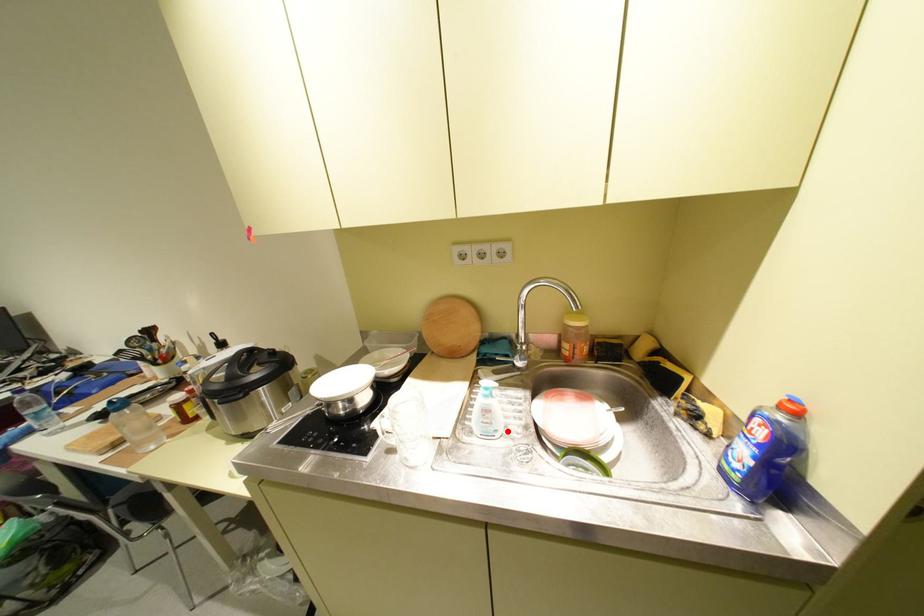
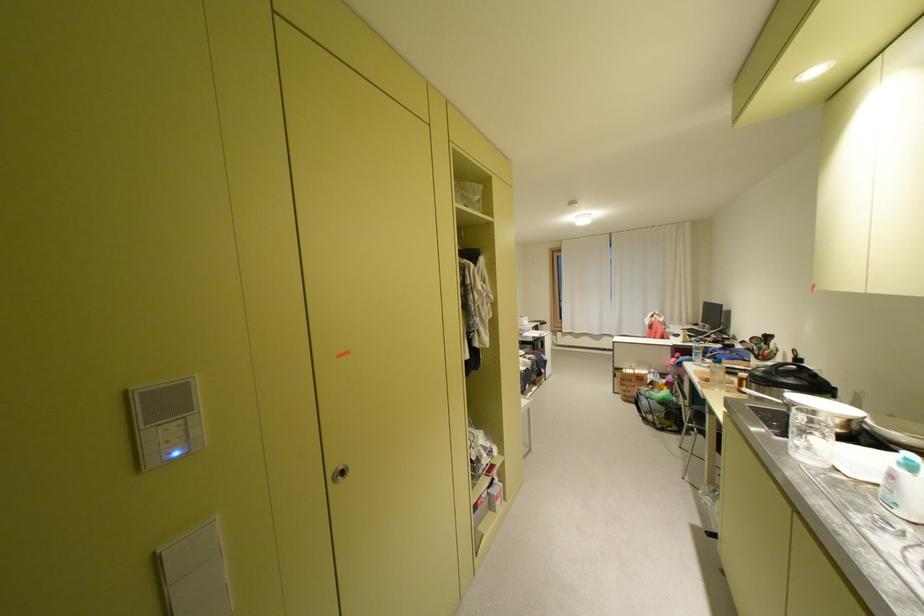
Question: I am providing you with two images of the same scene from different viewpoints. A red point is shown in image1. For the corresponding object point in image2, is it positioned nearer or farther from the camera?

Choices:
 (A) Nearer
 (B) Farther

Answer: (A)